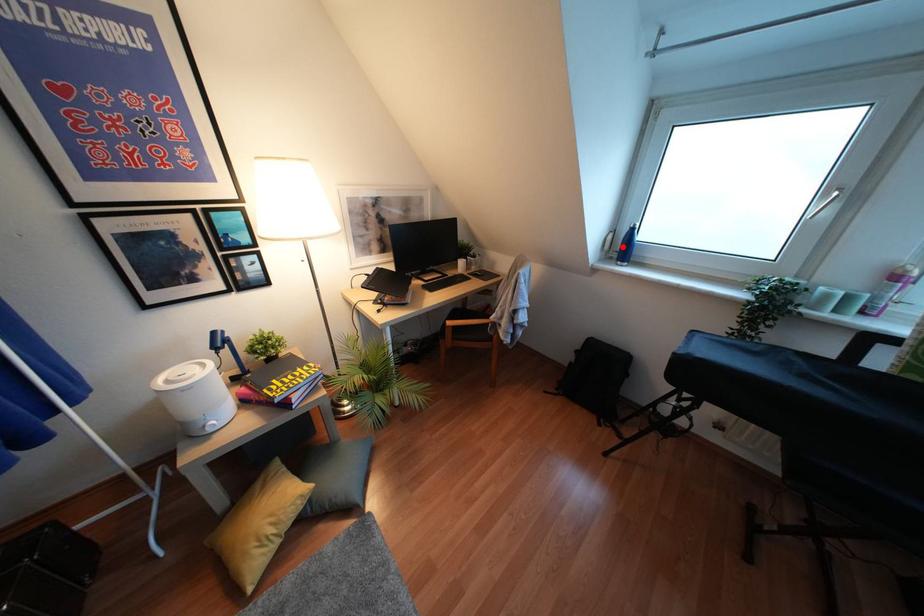
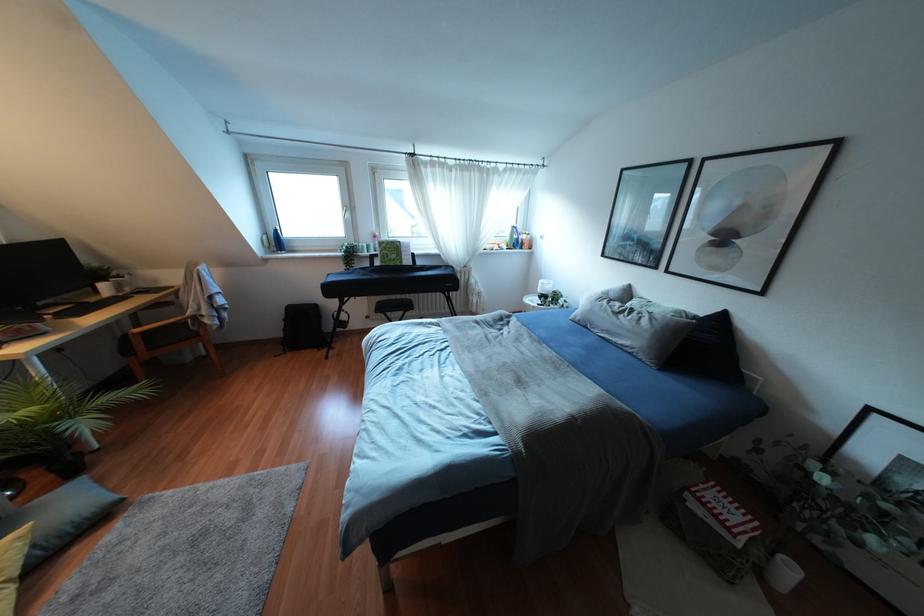
Where in the second image is the point corresponding to the highlighted location from the first image?

(275, 241)